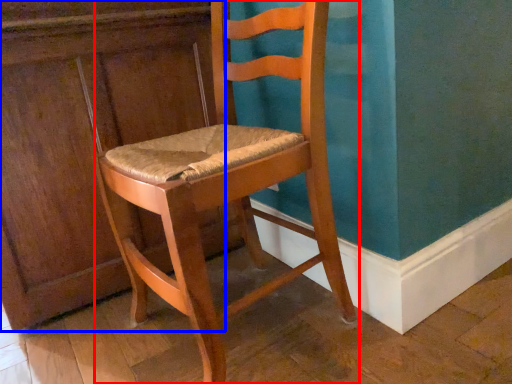
Question: Among these objects, which one is farthest to the camera, chair (highlighted by a red box) or dresser (highlighted by a blue box)?

Choices:
 (A) chair
 (B) dresser

Answer: (B)